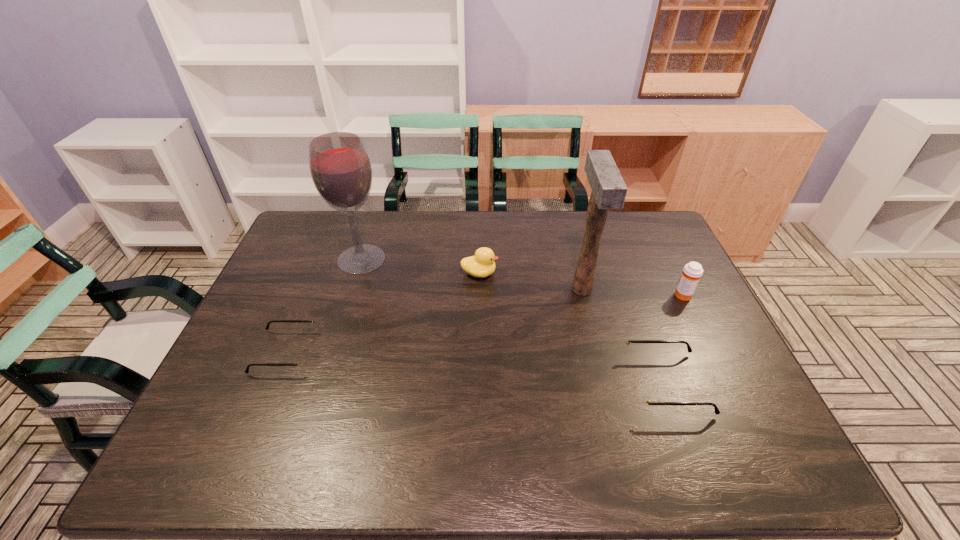
The image size is (960, 540). In order to click on vacant area situated at the hinge ends of the left spectacles in this screenshot , I will do `click(463, 352)`.

At what (x,y) coordinates should I click in order to perform the action: click on vacant space situated at the hinge ends of the taller spectacles. Please return your answer as a coordinate pair (x, y). Looking at the image, I should click on (546, 384).

Find the location of a particular element. The image size is (960, 540). free space located at the hinge ends of the taller spectacles is located at coordinates (477, 384).

Locate an element on the screen. vacant space located 0.370m at the hinge ends of the taller spectacles is located at coordinates (477, 384).

Where is `free space located on the beak of the third object from left to right`? This screenshot has height=540, width=960. free space located on the beak of the third object from left to right is located at coordinates (552, 273).

This screenshot has height=540, width=960. In order to click on vacant space situated 0.270m on the right of the alcohol in this screenshot , I will do `click(469, 259)`.

At what (x,y) coordinates should I click in order to perform the action: click on vacant space located 0.320m on the back of the rightmost object. Please return your answer as a coordinate pair (x, y). The width and height of the screenshot is (960, 540). Looking at the image, I should click on click(x=651, y=227).

Find the location of a particular element. The height and width of the screenshot is (540, 960). vacant space located on the front of the third object from right to left is located at coordinates click(594, 339).

At what (x,y) coordinates should I click in order to perform the action: click on object that is at the far edge. Please return your answer as a coordinate pair (x, y). The width and height of the screenshot is (960, 540). Looking at the image, I should click on (341, 171).

Locate an element on the screen. Image resolution: width=960 pixels, height=540 pixels. object that is at the near edge is located at coordinates (641, 398).